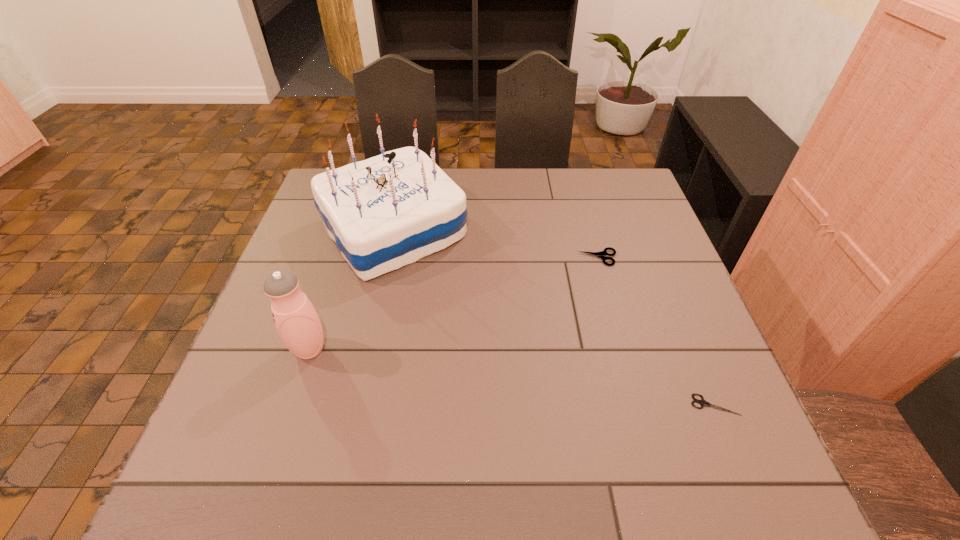
The height and width of the screenshot is (540, 960). What are the coordinates of `vacant space located on the back of the rightmost object` in the screenshot? It's located at (696, 360).

Locate an element on the screen. object that is at the far edge is located at coordinates (385, 212).

At what (x,y) coordinates should I click in order to perform the action: click on birthday cake at the left edge. Please return your answer as a coordinate pair (x, y). The width and height of the screenshot is (960, 540). Looking at the image, I should click on (385, 212).

Where is `thermos bottle present at the left edge`? The width and height of the screenshot is (960, 540). thermos bottle present at the left edge is located at coordinates (297, 322).

At what (x,y) coordinates should I click in order to perform the action: click on object that is at the far left corner. Please return your answer as a coordinate pair (x, y). Looking at the image, I should click on (385, 212).

Where is `free space at the far edge of the desktop`? Image resolution: width=960 pixels, height=540 pixels. free space at the far edge of the desktop is located at coordinates (480, 205).

Locate an element on the screen. Image resolution: width=960 pixels, height=540 pixels. free point at the near edge is located at coordinates (548, 481).

In the image, there is a desktop. Where is `vacant space at the left edge`? The width and height of the screenshot is (960, 540). vacant space at the left edge is located at coordinates (267, 403).

Locate an element on the screen. This screenshot has height=540, width=960. vacant region at the right edge of the desktop is located at coordinates (660, 308).

Identify the location of free region at the near left corner of the desktop. (208, 470).